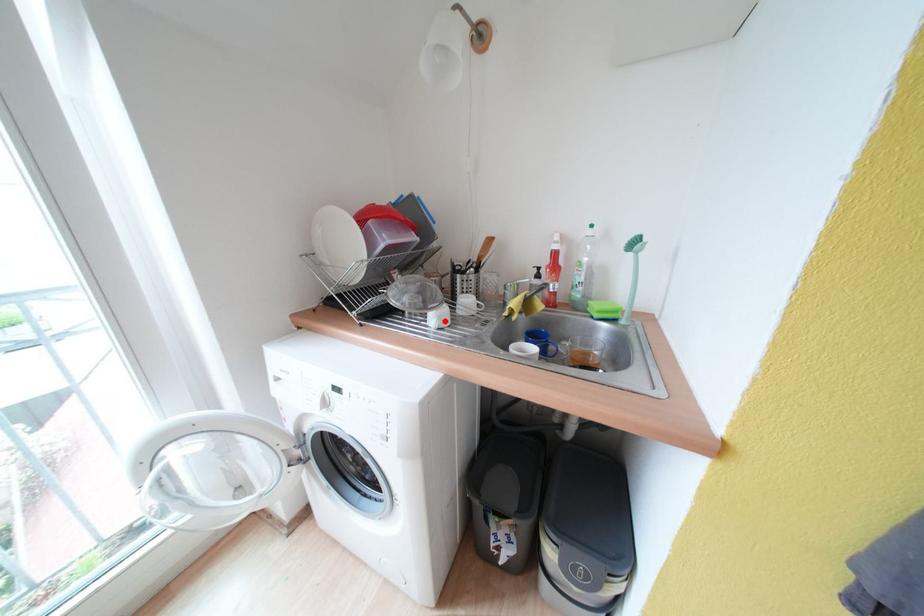
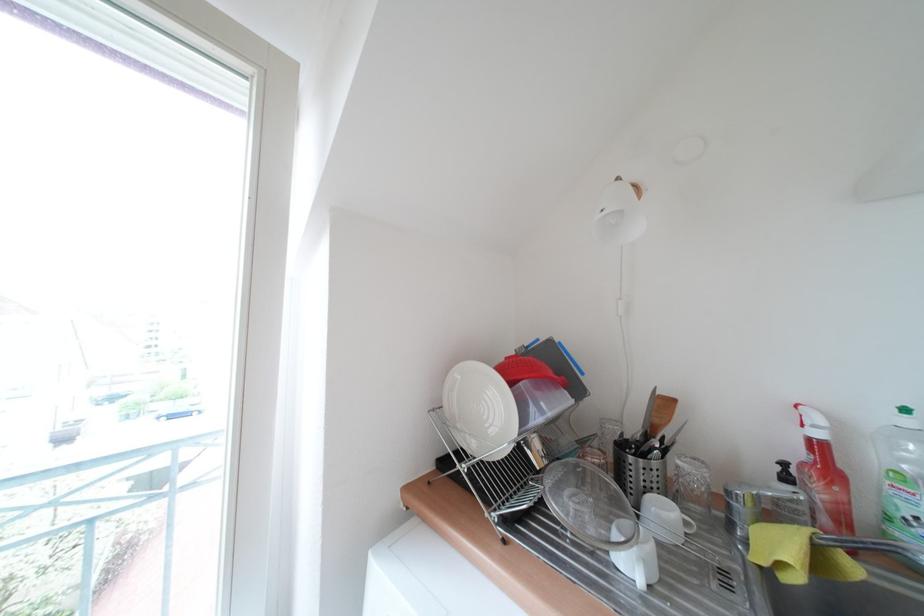
The point at the highlighted location is marked in the first image. Where is the corresponding point in the second image?

(651, 567)